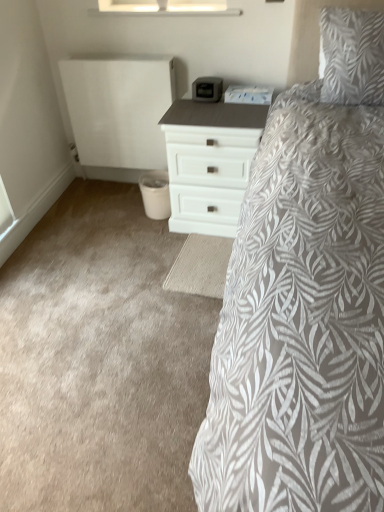
Question: From their relative heights in the image, would you say white leaf-patterned pillow at upper right is taller or shorter than white matte chest of drawers at center?

Choices:
 (A) tall
 (B) short

Answer: (B)

Question: Is point (322, 31) positioned closer to the camera than point (218, 116)?

Choices:
 (A) closer
 (B) farther

Answer: (A)

Question: Estimate the real-world distances between objects in this image. Which object is closer to the white leaf-patterned pillow at upper right?

Choices:
 (A) transparent glass window at upper center
 (B) white matte chest of drawers at center

Answer: (B)

Question: Which of these objects is positioned closest to the white leaf-patterned pillow at upper right?

Choices:
 (A) white matte chest of drawers at center
 (B) transparent glass window at upper center

Answer: (A)